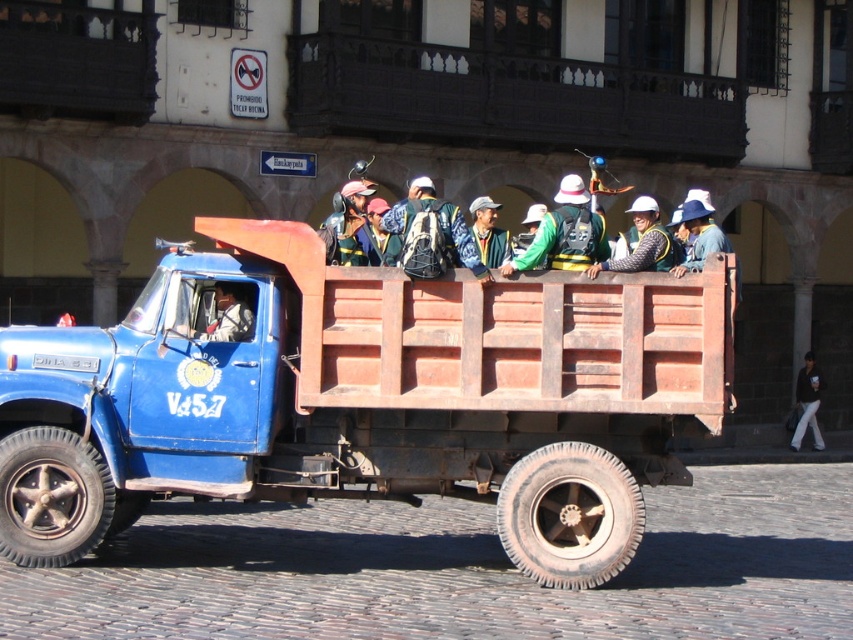
Does point (397, 216) come behind point (425, 186)?

No, it is in front of (425, 186).

Which is in front, point (722, 244) or point (451, 230)?

Point (451, 230)

Which is behind, point (596, 262) or point (387, 218)?

Point (596, 262)

This screenshot has height=640, width=853. Find the location of `green fabric jacket at center`. green fabric jacket at center is located at coordinates (587, 244).

Does blue matte truck at center have a larger size compared to green fabric jacket at center?

No.

Is blue matte truck at center closer to camera compared to green fabric jacket at center?

Yes, blue matte truck at center is in front of green fabric jacket at center.

The width and height of the screenshot is (853, 640). I want to click on blue matte truck at center, so click(x=364, y=397).

Does blue matte truck at center come in front of blue fabric backpack at center?

Yes.

I want to click on blue matte truck at center, so click(x=364, y=397).